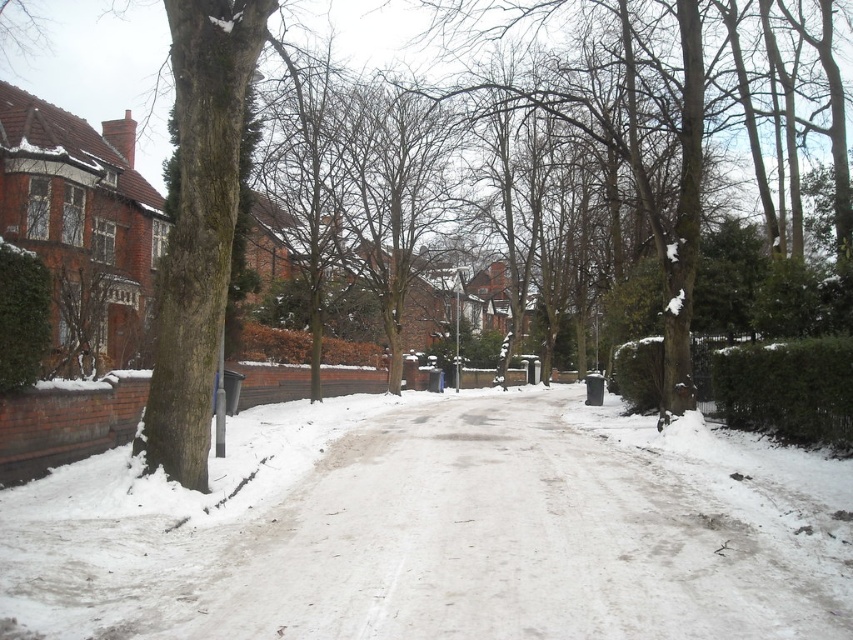
Is point (233, 589) in front of point (202, 289)?

Yes, point (233, 589) is closer to viewer.

Is white powdery snow at center thinner than green mossy bark tree at left?

In fact, white powdery snow at center might be wider than green mossy bark tree at left.

Does point (782, 513) come closer to viewer compared to point (229, 84)?

That is True.

In order to click on white powdery snow at center in this screenshot , I will do `click(440, 531)`.